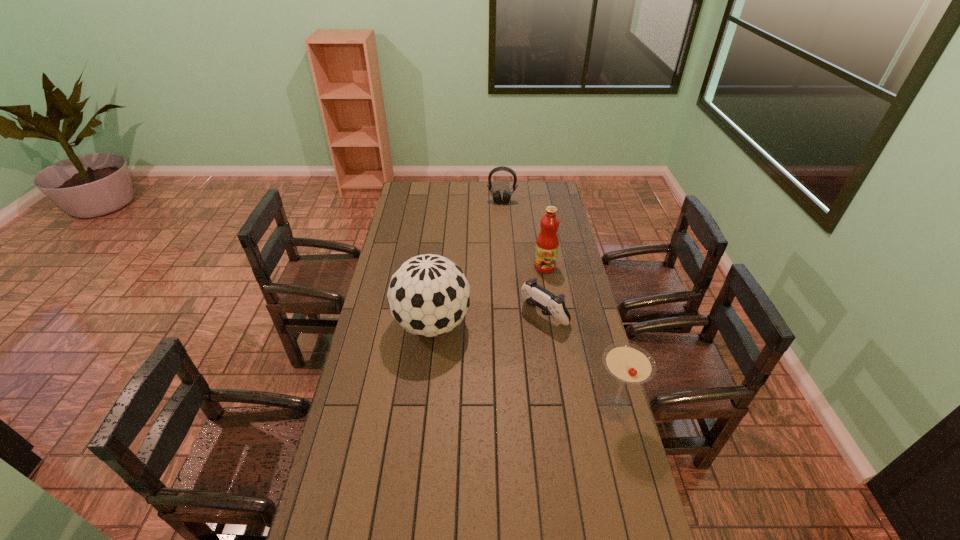
Identify the location of martini at the right edge. The height and width of the screenshot is (540, 960). (629, 363).

Locate an element on the screen. fruit juice that is at the right edge is located at coordinates (547, 244).

This screenshot has height=540, width=960. I want to click on control at the right edge, so click(535, 295).

At what (x,y) coordinates should I click in order to perform the action: click on vacant space at the far edge of the desktop. Please return your answer as a coordinate pair (x, y). Looking at the image, I should click on tap(498, 185).

In the image, there is a desktop. Where is `vacant region at the left edge`? The image size is (960, 540). vacant region at the left edge is located at coordinates (418, 222).

You are a GUI agent. You are given a task and a screenshot of the screen. Output one action in this format:
    pyautogui.click(x=<x>, y=<y>)
    Task: Click on the empty space between the martini and the soccer ball
    This screenshot has height=540, width=960.
    Given the screenshot: What is the action you would take?
    pyautogui.click(x=523, y=366)

The image size is (960, 540). Find the location of `unoccupied position between the soccer ball and the fruit juice`. unoccupied position between the soccer ball and the fruit juice is located at coordinates (489, 295).

Identify the location of free space between the soccer ball and the farthest object. The height and width of the screenshot is (540, 960). (467, 263).

Locate an element on the screen. vacant area that lies between the fruit juice and the rightmost object is located at coordinates (579, 338).

At what (x,y) coordinates should I click in order to perform the action: click on free area in between the soccer ball and the martini. Please return your answer as a coordinate pair (x, y). Looking at the image, I should click on [523, 366].